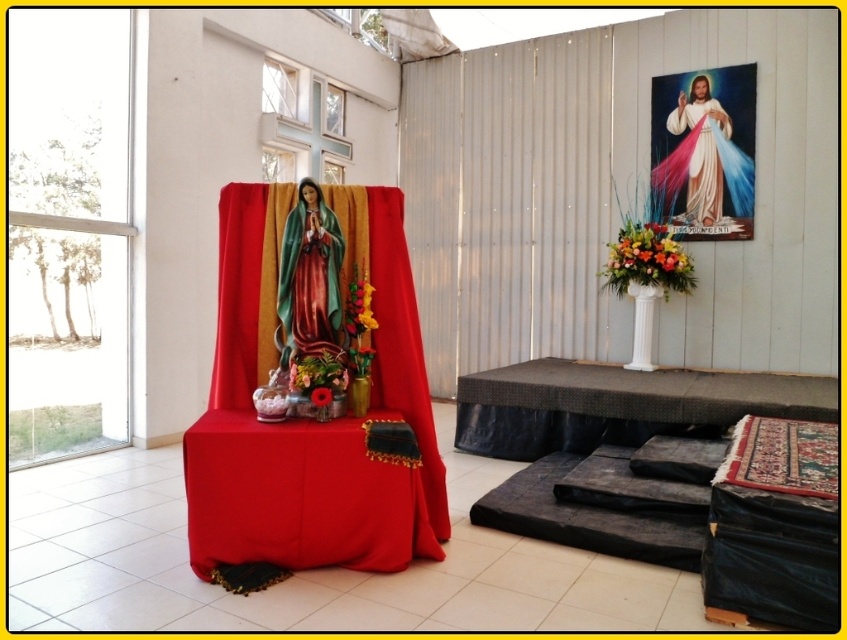
Question: Which point is farther from the camera taking this photo?

Choices:
 (A) (340, 248)
 (B) (299, 454)
 (C) (739, 400)

Answer: (C)

Question: Does black textured table at lower right have a lesser width compared to shiny green robe at center?

Choices:
 (A) yes
 (B) no

Answer: (B)

Question: Is velvet red table at center to the right of shiny green robe at center from the viewer's perspective?

Choices:
 (A) yes
 (B) no

Answer: (A)

Question: Which point is closer to the camera?

Choices:
 (A) (690, 397)
 (B) (428, 470)

Answer: (B)

Question: Among these objects, which one is farthest from the camera?

Choices:
 (A) shiny green robe at center
 (B) black textured table at lower right
 (C) white silk robe at upper right
 (D) velvet red table at center

Answer: (C)

Question: Is shiny green robe at center above white silk robe at upper right?

Choices:
 (A) no
 (B) yes

Answer: (A)